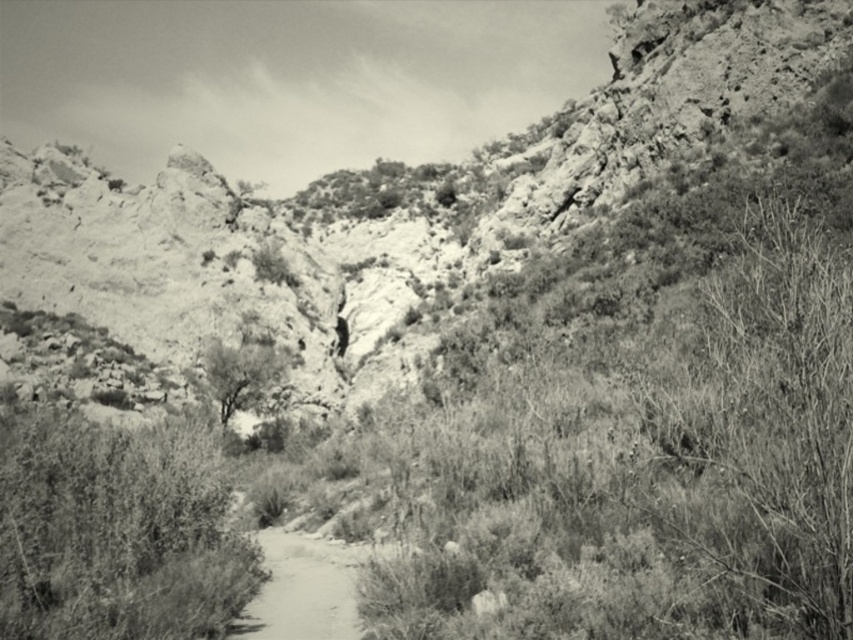
You are standing on the dirt path in the foreground of the scene. You see two points marked in the image. Which point is closer to you, point (662, 68) or point (338, 561)?

Point (662, 68) is closer to you because it is further to the viewer than point (338, 561).

Based on the photo, you are a hiker trying to navigate through the arid landscape. You see a rugged stone mountain at center and a thick green bush at center. Which object is taller?

The rugged stone mountain at center is taller than the thick green bush at center.

You are a hiker planning to climb the rugged stone mountain at center and pass by the grainy gray tree at center. Based on the scene, which object should you encounter first as you start your climb?

The grainy gray tree at center should be encountered first since the rugged stone mountain at center is positioned above it, meaning the tree is lower down the path.